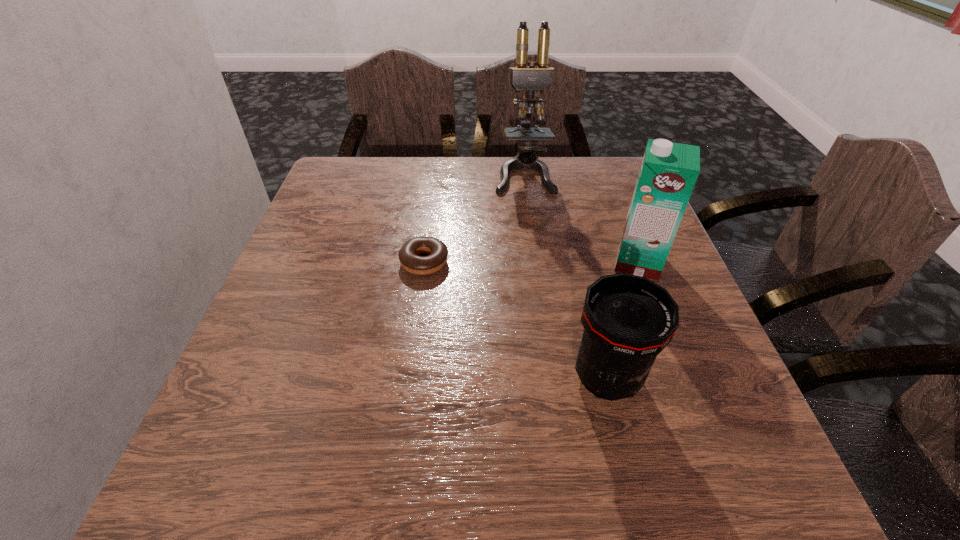
Find the location of a particular element. the farthest object is located at coordinates (528, 79).

Locate an element on the screen. the tallest object is located at coordinates (528, 79).

You are a GUI agent. You are given a task and a screenshot of the screen. Output one action in this format:
    pyautogui.click(x=<x>, y=<y>)
    Task: Click on the second tallest object
    The height and width of the screenshot is (540, 960).
    Given the screenshot: What is the action you would take?
    pyautogui.click(x=668, y=173)

This screenshot has width=960, height=540. What are the coordinates of `the rightmost object` in the screenshot? It's located at (668, 173).

The height and width of the screenshot is (540, 960). Identify the location of the nearest object. (628, 320).

Find the location of `the third tallest object`. the third tallest object is located at coordinates (628, 320).

Where is `the shortest object`? The width and height of the screenshot is (960, 540). the shortest object is located at coordinates (408, 255).

This screenshot has width=960, height=540. Find the location of `the leftmost object`. the leftmost object is located at coordinates (408, 255).

Locate an element on the screen. free space located 0.350m at the eyepieces of the farthest object is located at coordinates (540, 290).

Where is `vacant space located on the back of the carton`? Image resolution: width=960 pixels, height=540 pixels. vacant space located on the back of the carton is located at coordinates (616, 205).